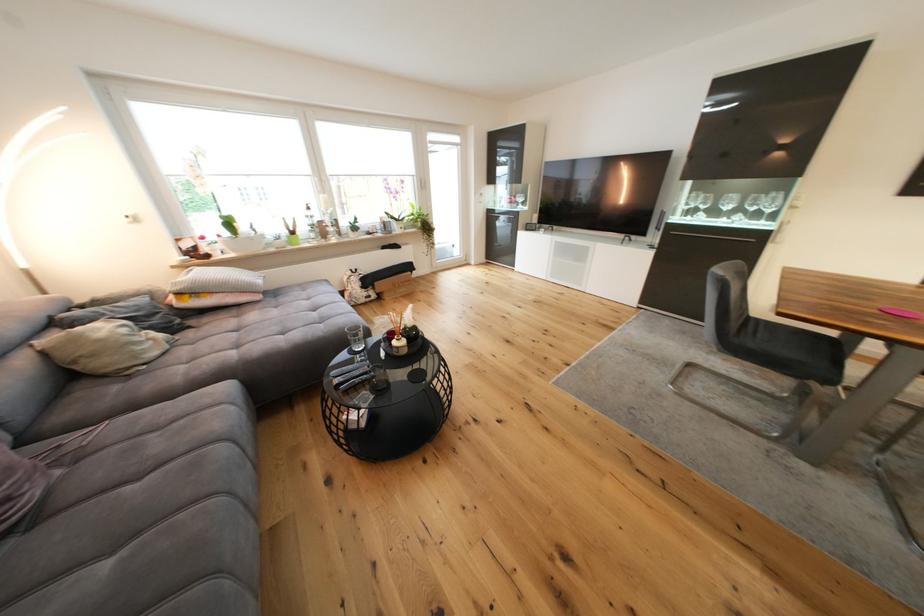
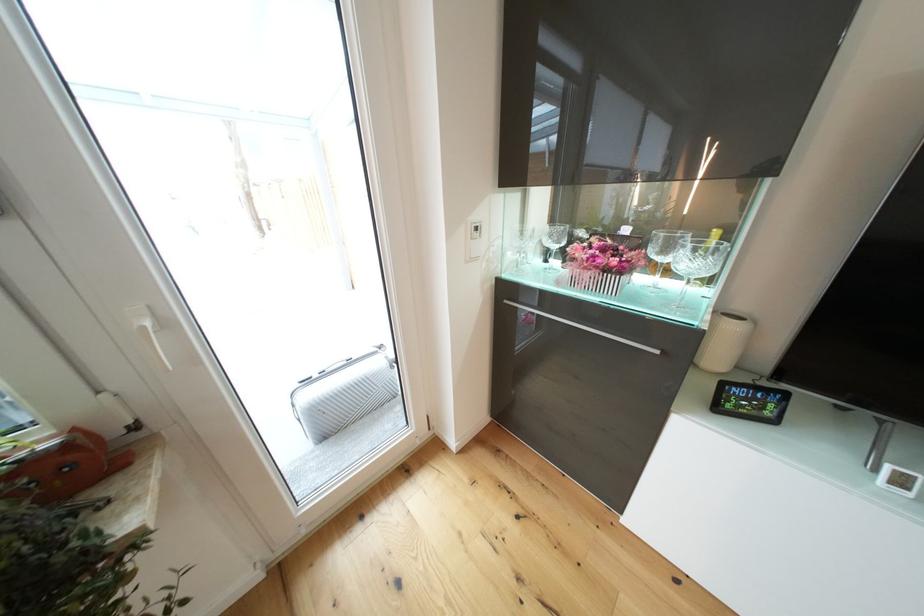
Question: The images are taken continuously from a first-person perspective. In which direction are you moving?

Choices:
 (A) Left
 (B) Right
 (C) Forward
 (D) Backward

Answer: (C)